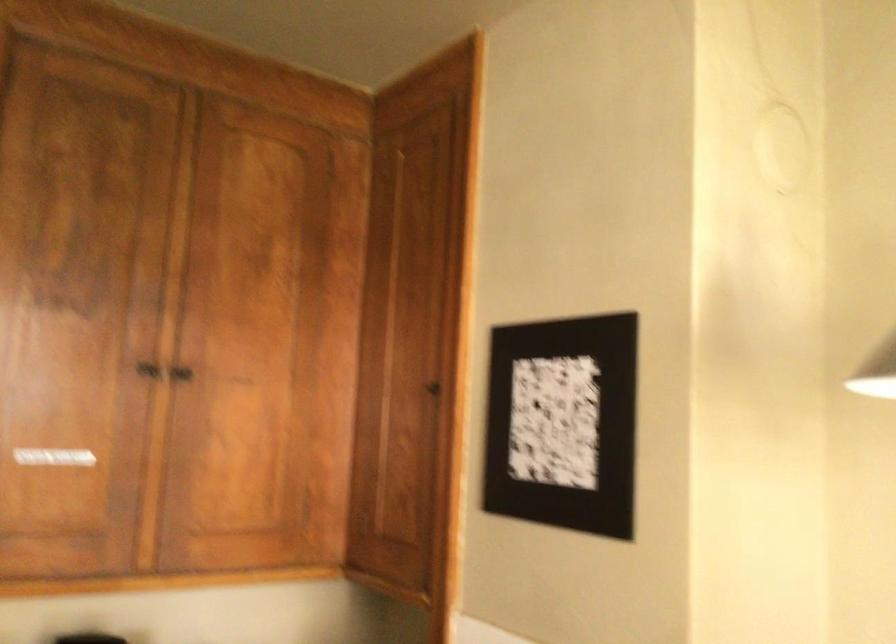
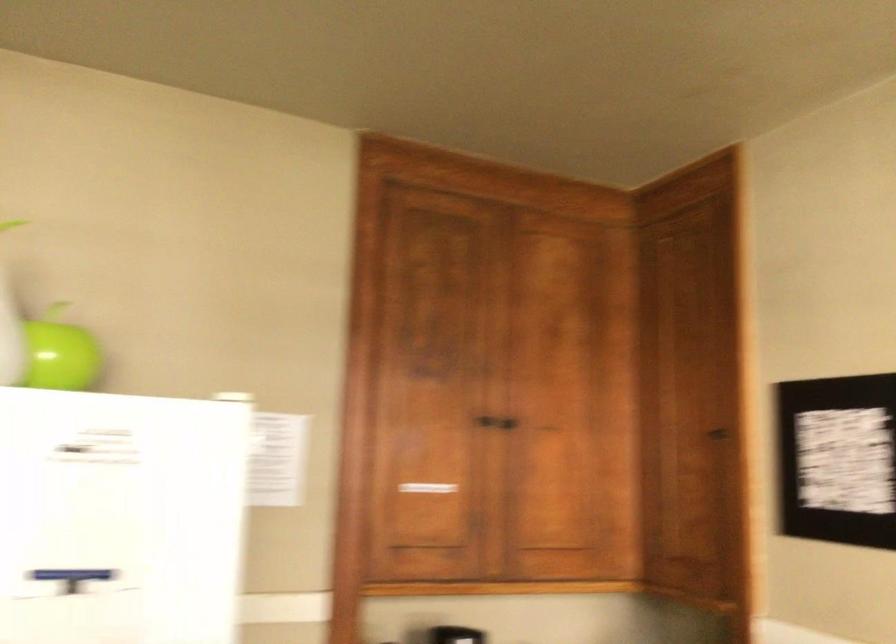
Find the pixel in the second image that matches point (162, 364) in the first image.

(485, 420)